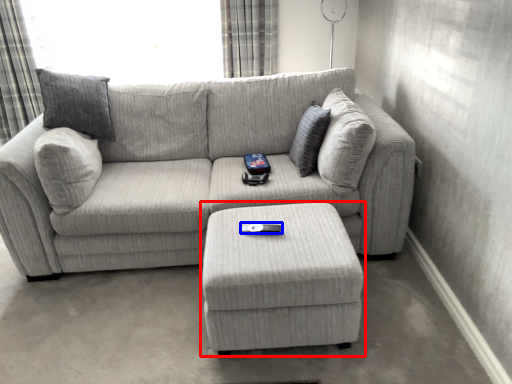
Question: Among these objects, which one is farthest to the camera, table (highlighted by a red box) or remote (highlighted by a blue box)?

Choices:
 (A) table
 (B) remote

Answer: (B)